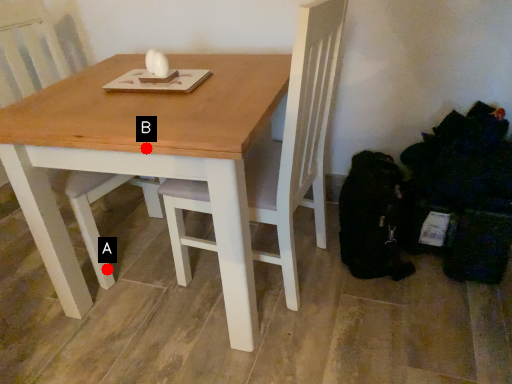
Question: Two points are circled on the image, labeled by A and B beside each circle. Which point is further to the camera?

Choices:
 (A) A is further
 (B) B is further

Answer: (A)